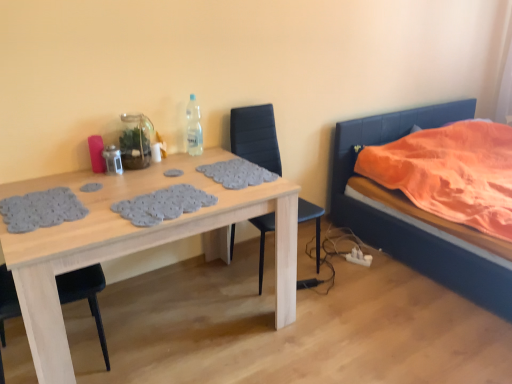
Locate an element on the screen. free space in front of black leather chair at center is located at coordinates (318, 317).